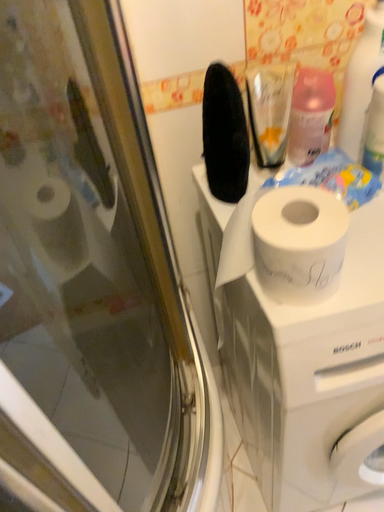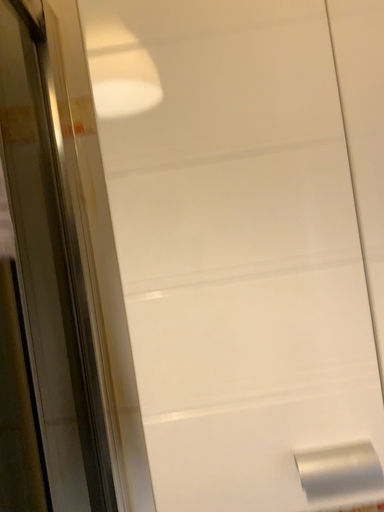
Question: How did the camera likely rotate when shooting the video?

Choices:
 (A) rotated right
 (B) rotated left

Answer: (B)